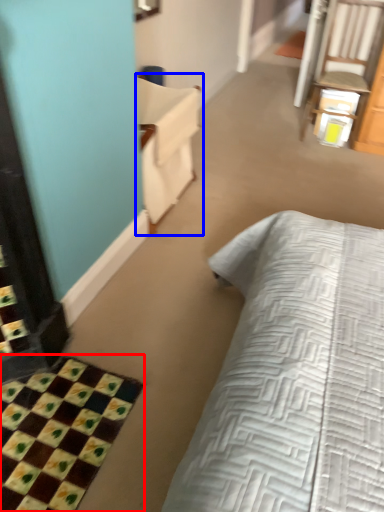
Question: Which point is further to the camera, bath mat (highlighted by a red box) or armchair (highlighted by a blue box)?

Choices:
 (A) bath mat
 (B) armchair

Answer: (B)